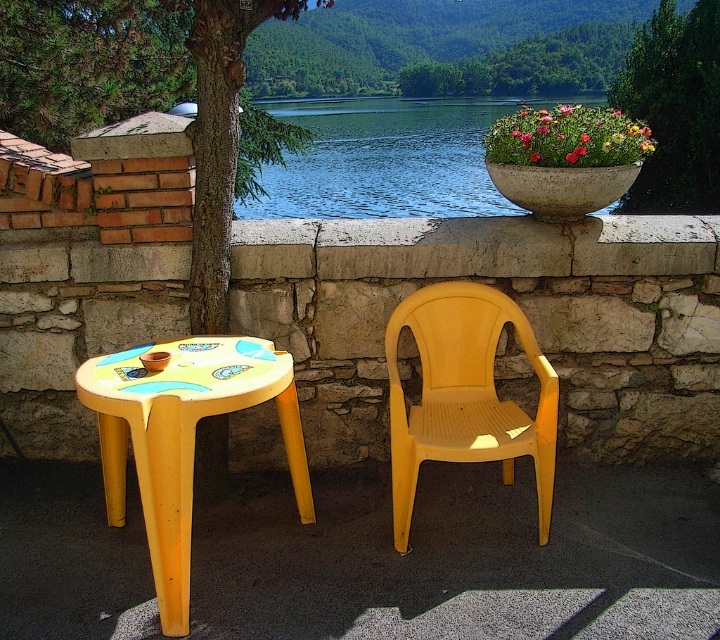
Does yellow plastic chair at center have a greater width compared to green leafy tree at upper center?

In fact, yellow plastic chair at center might be narrower than green leafy tree at upper center.

Which is in front, point (554, 397) or point (716, 205)?

Positioned in front is point (554, 397).

Find the location of a particular element. The image size is (720, 640). yellow plastic chair at center is located at coordinates (464, 394).

Describe the element at coordinates (198, 109) in the screenshot. The image size is (720, 640). I see `green rough bark tree at upper left` at that location.

Is green rough bark tree at upper left below green leafy tree at upper center?

Yes.

You are a GUI agent. You are given a task and a screenshot of the screen. Output one action in this format:
    pyautogui.click(x=<x>, y=<y>)
    Task: Click on the green rough bark tree at upper left
    
    Given the screenshot: What is the action you would take?
    pyautogui.click(x=198, y=109)

Between yellow plastic table at lower left and yellow plastic chair at center, which one appears on the left side from the viewer's perspective?

yellow plastic table at lower left is more to the left.

Image resolution: width=720 pixels, height=640 pixels. Describe the element at coordinates (181, 436) in the screenshot. I see `yellow plastic table at lower left` at that location.

Locate an element on the screen. yellow plastic table at lower left is located at coordinates (181, 436).